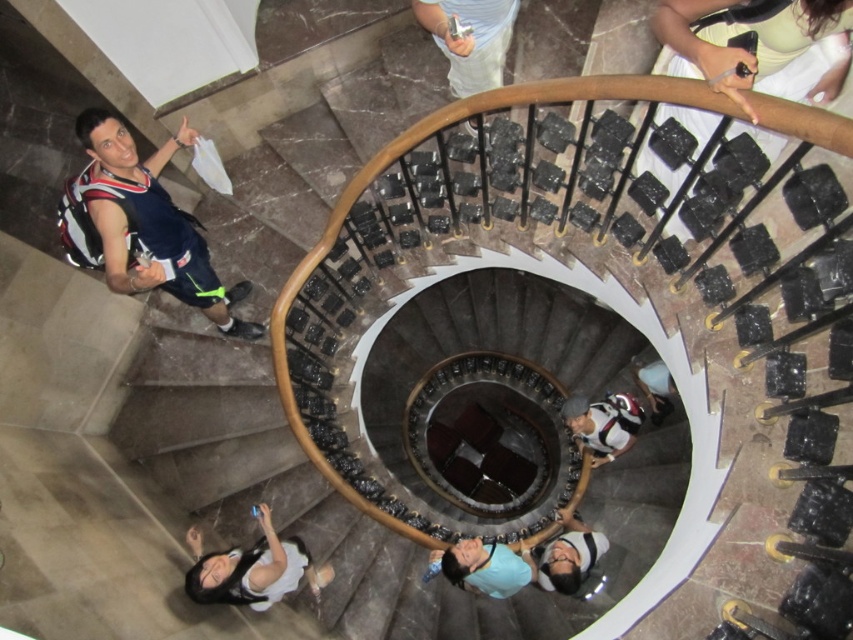
Who is shorter, matte blue shirt at left or matte black backpack at center?

With less height is matte black backpack at center.

Can you confirm if matte blue shirt at left is positioned to the left of matte black backpack at center?

Yes, matte blue shirt at left is to the left of matte black backpack at center.

Locate an element on the screen. This screenshot has height=640, width=853. matte blue shirt at left is located at coordinates (141, 225).

Does matte blue shirt at left have a smaller size compared to white fabric at center?

Incorrect, matte blue shirt at left is not smaller in size than white fabric at center.

Looking at this image, between matte blue shirt at left and white fabric at center, which one has less height?

white fabric at center

Which is in front, point (76, 248) or point (515, 3)?

Point (76, 248)

I want to click on matte blue shirt at left, so click(x=141, y=225).

Can you confirm if matte blue shirt at center is shorter than white cotton shirt at lower center?

In fact, matte blue shirt at center may be taller than white cotton shirt at lower center.

Who is positioned more to the right, matte blue shirt at center or white cotton shirt at lower center?

From the viewer's perspective, white cotton shirt at lower center appears more on the right side.

Where is `matte blue shirt at center`? matte blue shirt at center is located at coordinates (485, 566).